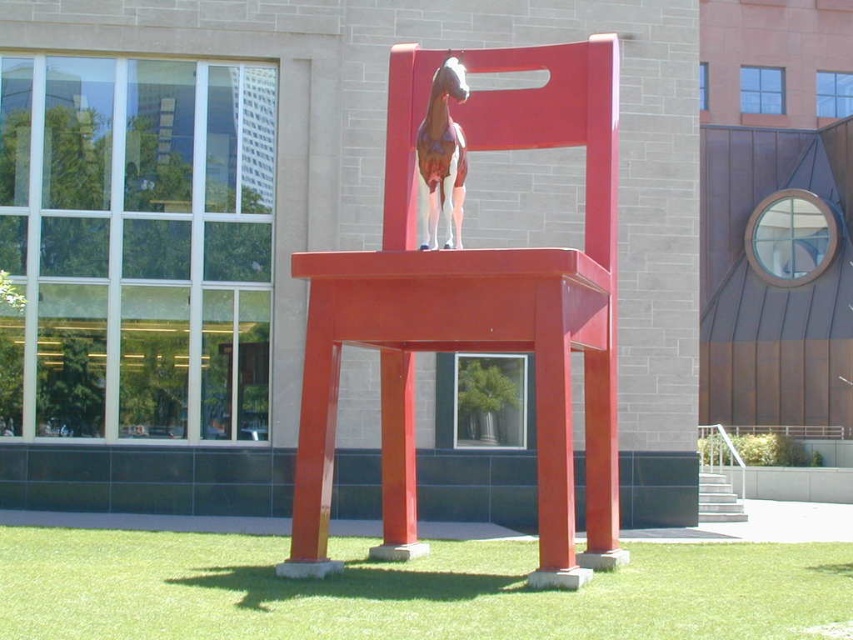
Question: Which of the following is the farthest from the observer?

Choices:
 (A) matte red chair at center
 (B) green grass at lower center

Answer: (A)

Question: Is matte red chair at center further to camera compared to painted wood horse at center?

Choices:
 (A) no
 (B) yes

Answer: (A)

Question: Where is green grass at lower center located in relation to painted wood horse at center in the image?

Choices:
 (A) above
 (B) below

Answer: (B)

Question: Is green grass at lower center to the left of painted wood horse at center from the viewer's perspective?

Choices:
 (A) no
 (B) yes

Answer: (B)

Question: Which of the following is the closest to the observer?

Choices:
 (A) (427, 148)
 (B) (119, 552)
 (C) (395, 285)

Answer: (C)

Question: Among these objects, which one is farthest from the camera?

Choices:
 (A) painted wood horse at center
 (B) matte red chair at center
 (C) green grass at lower center

Answer: (A)